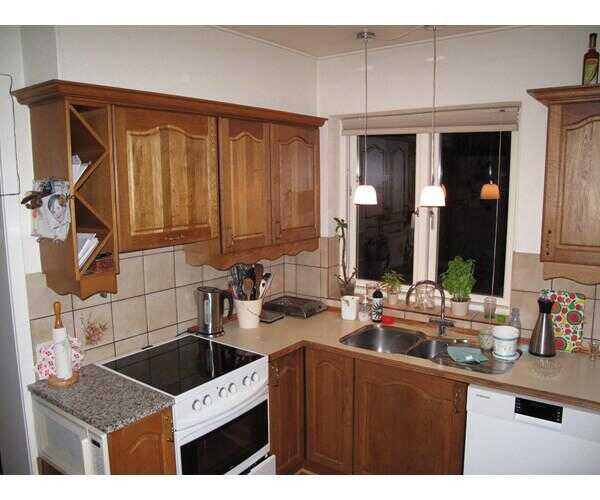
Locate an element on the screen. white walls is located at coordinates point(541,157).